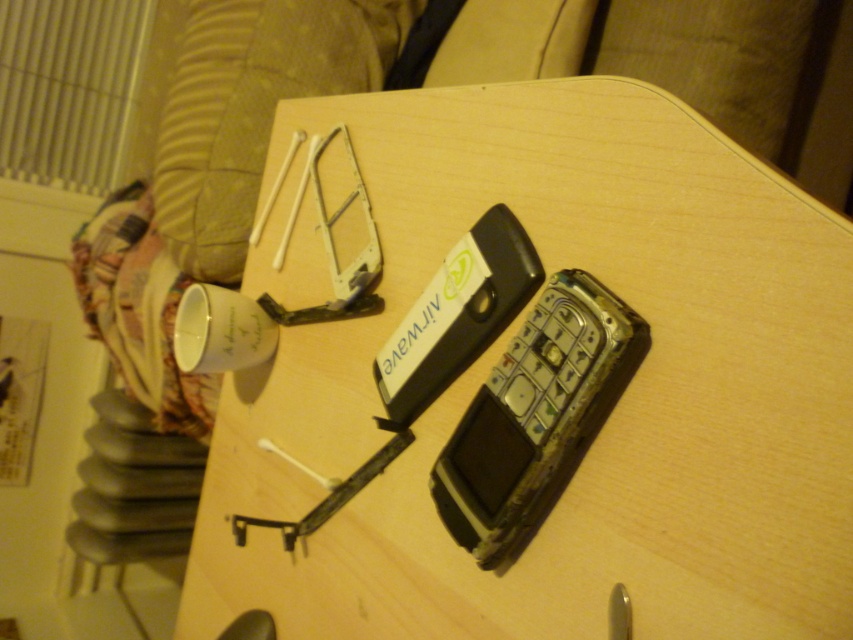
Question: Among these points, which one is nearest to the camera?

Choices:
 (A) (724, 186)
 (B) (587, 358)

Answer: (A)

Question: Which object is closer to the camera taking this photo?

Choices:
 (A) wooden table at center
 (B) rusty metallic phone at center

Answer: (A)

Question: Is wooden table at center positioned at the back of rusty metallic phone at center?

Choices:
 (A) yes
 (B) no

Answer: (B)

Question: Can you confirm if wooden table at center is positioned to the right of rusty metallic phone at center?

Choices:
 (A) no
 (B) yes

Answer: (A)

Question: Which of the following is the farthest from the observer?

Choices:
 (A) rusty metallic phone at center
 (B) wooden table at center

Answer: (A)

Question: Does wooden table at center appear on the right side of rusty metallic phone at center?

Choices:
 (A) no
 (B) yes

Answer: (A)